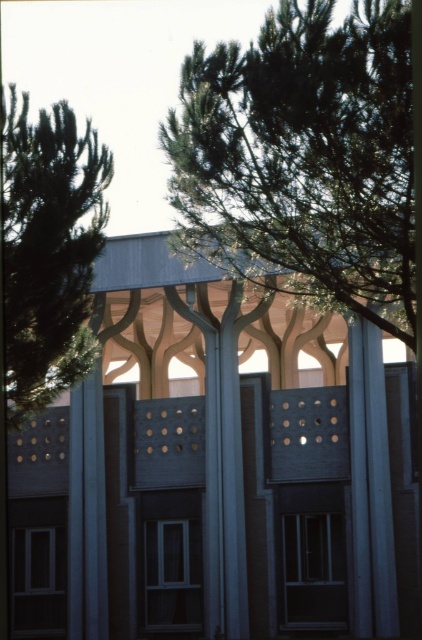
Describe the element at coordinates (305, 156) in the screenshot. The width and height of the screenshot is (422, 640). I see `green leafy tree at upper center` at that location.

Who is more forward, (267,232) or (62,108)?

Point (267,232)

Is point (262, 224) positioned after point (72, 365)?

No.

Find the location of a particular element. green leafy tree at upper center is located at coordinates (305, 156).